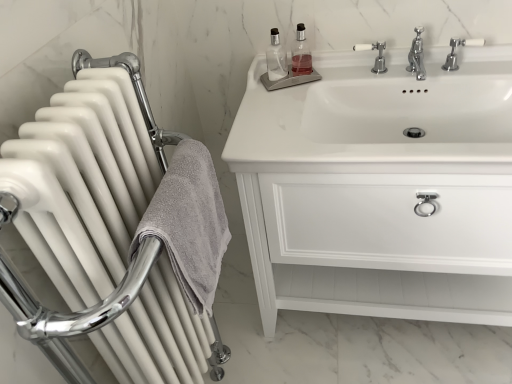
What do you see at coordinates (381, 116) in the screenshot? The width and height of the screenshot is (512, 384). I see `white glossy sink at upper right` at bounding box center [381, 116].

What is the approximate width of white plastic tap at upper right, arranged as the 1th tap when viewed from the right?

white plastic tap at upper right, arranged as the 1th tap when viewed from the right, is 2.62 inches in width.

Describe the element at coordinates (189, 223) in the screenshot. I see `gray textured towel at left` at that location.

Describe the element at coordinates (105, 233) in the screenshot. The height and width of the screenshot is (384, 512). I see `white glossy radiator at left` at that location.

The height and width of the screenshot is (384, 512). In order to click on white glossy radiator at left in this screenshot , I will do 105,233.

This screenshot has height=384, width=512. What do you see at coordinates (276, 58) in the screenshot? I see `clear glass bottle at upper center` at bounding box center [276, 58].

Find the location of `white glossy sink at upper right`. white glossy sink at upper right is located at coordinates (381, 116).

Is clear glass bottle at upper center in front of or behind white plastic tap at upper right, marked as the 2th tap in a left-to-right arrangement, in the image?

In the image, clear glass bottle at upper center appears behind white plastic tap at upper right, marked as the 2th tap in a left-to-right arrangement.

Could you measure the distance between clear glass bottle at upper center and white plastic tap at upper right, arranged as the 1th tap when viewed from the right?

clear glass bottle at upper center is 20.27 inches away from white plastic tap at upper right, arranged as the 1th tap when viewed from the right.

Is clear glass bottle at upper center placed right next to white plastic tap at upper right, marked as the 2th tap in a left-to-right arrangement?

No, clear glass bottle at upper center is not touching white plastic tap at upper right, marked as the 2th tap in a left-to-right arrangement.

Image resolution: width=512 pixels, height=384 pixels. In order to click on sink below the gray textured towel at left (from a real-world perspective) in this screenshot , I will do (381, 116).

Who is smaller, gray textured towel at left or white glossy sink at upper right?

Smaller between the two is gray textured towel at left.

Is gray textured towel at left at the right side of white glossy sink at upper right?

In fact, gray textured towel at left is to the left of white glossy sink at upper right.

From the image's perspective, is gray textured towel at left on white glossy sink at upper right?

No, from the image's perspective, gray textured towel at left is not above white glossy sink at upper right.

What's the angular difference between white glossy cabinet at upper right and clear glass soap dispenser at upper center's facing directions?

Result: There is a 24-degree angle between the facing directions of white glossy cabinet at upper right and clear glass soap dispenser at upper center.

Which object is further away from the camera, white glossy cabinet at upper right or clear glass soap dispenser at upper center?

clear glass soap dispenser at upper center.

Considering the sizes of objects white glossy cabinet at upper right and clear glass soap dispenser at upper center in the image provided, who is shorter, white glossy cabinet at upper right or clear glass soap dispenser at upper center?

Standing shorter between the two is clear glass soap dispenser at upper center.

Is white glossy cabinet at upper right oriented away from clear glass soap dispenser at upper center?

That's not correct — white glossy cabinet at upper right is not looking away from clear glass soap dispenser at upper center.

Is white plastic tap at upper right, marked as the 2th tap in a left-to-right arrangement, far away from white glossy sink at upper right?

No, there isn't a large distance between white plastic tap at upper right, marked as the 2th tap in a left-to-right arrangement, and white glossy sink at upper right.

From the image's perspective, would you say white plastic tap at upper right, arranged as the 1th tap when viewed from the right, is shown under white glossy sink at upper right?

Actually, white plastic tap at upper right, arranged as the 1th tap when viewed from the right, appears above white glossy sink at upper right in the image.

From a real-world perspective, is white plastic tap at upper right, arranged as the 1th tap when viewed from the right, physically located above or below white glossy sink at upper right?

white plastic tap at upper right, arranged as the 1th tap when viewed from the right, is above white glossy sink at upper right.

How distant is white plastic tap at upper right, marked as the 2th tap in a left-to-right arrangement, from white glossy sink at upper right?

13.96 inches.

Is gray textured towel at left spatially inside white glossy cabinet at upper right, or outside of it?

gray textured towel at left exists outside the volume of white glossy cabinet at upper right.

Considering the sizes of objects gray textured towel at left and white glossy cabinet at upper right in the image provided, who is thinner, gray textured towel at left or white glossy cabinet at upper right?

With smaller width is gray textured towel at left.

Where is `bathroom cabinet behind the gray textured towel at left`? The width and height of the screenshot is (512, 384). bathroom cabinet behind the gray textured towel at left is located at coordinates (380, 188).

Is gray textured towel at left facing away from white glossy cabinet at upper right?

No, gray textured towel at left's orientation is not away from white glossy cabinet at upper right.

Between clear glass soap dispenser at upper center and white plastic tap at upper right, marked as the 2th tap in a left-to-right arrangement, which one has smaller width?

clear glass soap dispenser at upper center.

Is clear glass soap dispenser at upper center bigger or smaller than white plastic tap at upper right, arranged as the 1th tap when viewed from the right?

In the image, clear glass soap dispenser at upper center appears to be smaller than white plastic tap at upper right, arranged as the 1th tap when viewed from the right.

Could you tell me if clear glass soap dispenser at upper center is facing white plastic tap at upper right, marked as the 2th tap in a left-to-right arrangement?

No.

From the image's perspective, would you say clear glass soap dispenser at upper center is shown under white plastic tap at upper right, arranged as the 1th tap when viewed from the right?

Incorrect, from the image's perspective, clear glass soap dispenser at upper center is higher than white plastic tap at upper right, arranged as the 1th tap when viewed from the right.

What's the angular difference between gray textured towel at left and white plastic tap at upper right, marked as the 2th tap in a left-to-right arrangement,'s facing directions?

The angle between the facing direction of gray textured towel at left and the facing direction of white plastic tap at upper right, marked as the 2th tap in a left-to-right arrangement, is 91 degrees.

Which object is positioned more to the right, gray textured towel at left or white plastic tap at upper right, arranged as the 1th tap when viewed from the right?

From the viewer's perspective, white plastic tap at upper right, arranged as the 1th tap when viewed from the right, appears more on the right side.

Does gray textured towel at left lie in front of white plastic tap at upper right, arranged as the 1th tap when viewed from the right?

Yes.

Is there a large distance between gray textured towel at left and white plastic tap at upper right, arranged as the 1th tap when viewed from the right?

gray textured towel at left is actually quite close to white plastic tap at upper right, arranged as the 1th tap when viewed from the right.

I want to click on toiletry that appears on the left of white plastic tap at upper right, arranged as the 1th tap when viewed from the right, so click(276, 58).

Identify the location of bath towel located in front of the white glossy sink at upper right. The height and width of the screenshot is (384, 512). (189, 223).

Based on their spatial positions, is clear glass bottle at upper center or white ceramic tap at upper center, which appears as the second tap when viewed from the right, closer to clear glass soap dispenser at upper center?

clear glass bottle at upper center is closer to clear glass soap dispenser at upper center.

From the image, which object appears to be farther from white glossy sink at upper right, clear glass soap dispenser at upper center or white plastic tap at upper right, marked as the 2th tap in a left-to-right arrangement?

white plastic tap at upper right, marked as the 2th tap in a left-to-right arrangement, lies further to white glossy sink at upper right than the other object.

Which object lies nearer to the anchor point clear glass bottle at upper center, white ceramic tap at upper center, the first tap positioned from the left, or clear glass soap dispenser at upper center?

Based on the image, clear glass soap dispenser at upper center appears to be nearer to clear glass bottle at upper center.

Which object lies further to the anchor point white glossy radiator at left, clear glass soap dispenser at upper center or gray textured towel at left?

Based on the image, clear glass soap dispenser at upper center appears to be further to white glossy radiator at left.

Considering their positions, is white glossy radiator at left positioned further to gray textured towel at left than clear glass soap dispenser at upper center?

clear glass soap dispenser at upper center.

Which object lies nearer to the anchor point white ceramic tap at upper center, the first tap positioned from the left, gray textured towel at left or white glossy radiator at left?

gray textured towel at left lies closer to white ceramic tap at upper center, the first tap positioned from the left, than the other object.

When comparing their distances from white glossy cabinet at upper right, does white plastic tap at upper right, arranged as the 1th tap when viewed from the right, or clear glass soap dispenser at upper center seem closer?

Based on the image, clear glass soap dispenser at upper center appears to be nearer to white glossy cabinet at upper right.

Based on their spatial positions, is white ceramic tap at upper center, the first tap positioned from the left, or white plastic tap at upper right, arranged as the 1th tap when viewed from the right, further from white glossy radiator at left?

white plastic tap at upper right, arranged as the 1th tap when viewed from the right, is further to white glossy radiator at left.

Where is `bathroom cabinet located between white glossy radiator at left and clear glass soap dispenser at upper center in the depth direction`? The image size is (512, 384). bathroom cabinet located between white glossy radiator at left and clear glass soap dispenser at upper center in the depth direction is located at coordinates (380, 188).

This screenshot has width=512, height=384. I want to click on tap positioned between white glossy radiator at left and clear glass bottle at upper center from near to far, so click(x=456, y=54).

The width and height of the screenshot is (512, 384). Identify the location of sink located between white glossy radiator at left and clear glass soap dispenser at upper center in the depth direction. (381, 116).

You are a GUI agent. You are given a task and a screenshot of the screen. Output one action in this format:
    pyautogui.click(x=<x>, y=<y>)
    Task: Click on the sink located between gray textured towel at left and white glossy cabinet at upper right in the left-right direction
    Image resolution: width=512 pixels, height=384 pixels.
    Given the screenshot: What is the action you would take?
    pyautogui.click(x=381, y=116)